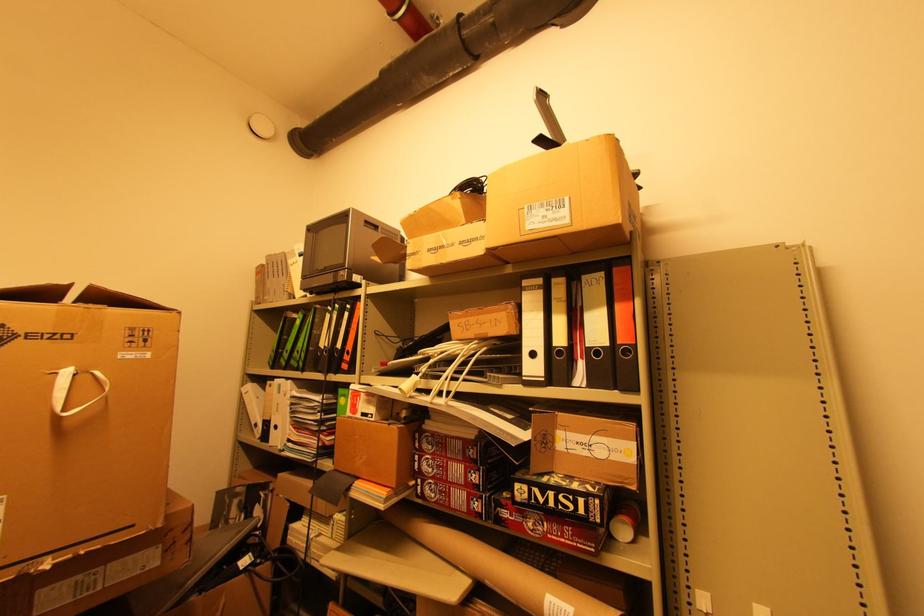
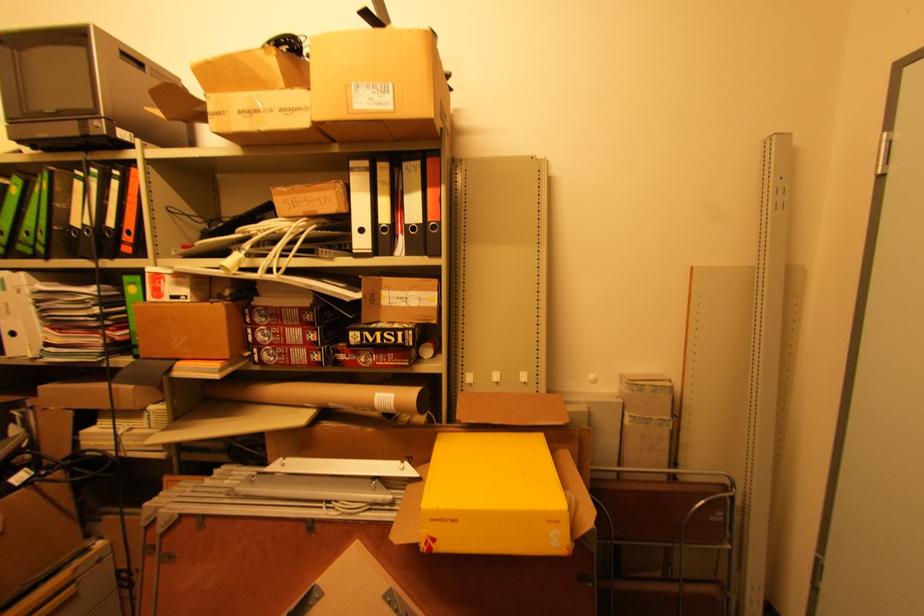
The point at (350, 359) is marked in the first image. Where is the corresponding point in the second image?

(131, 238)